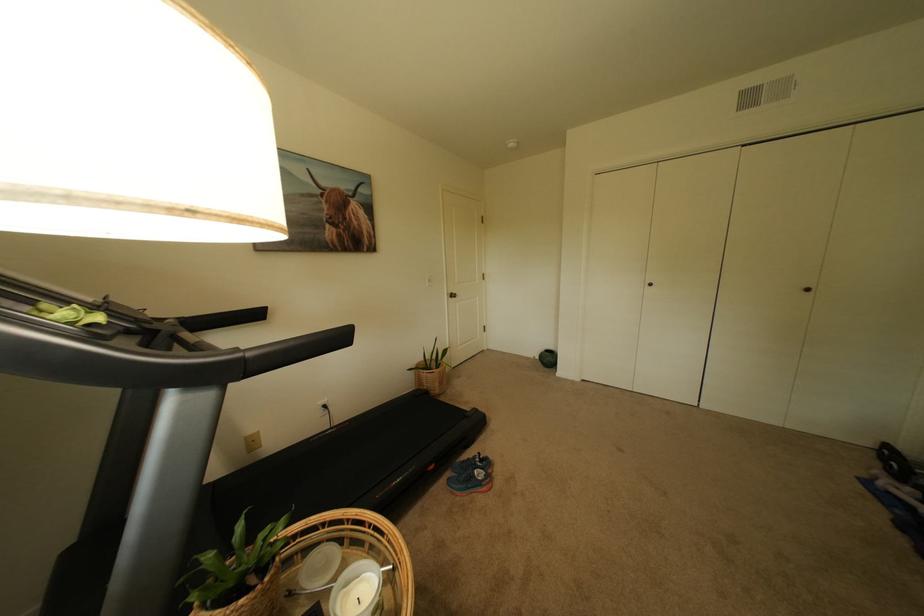
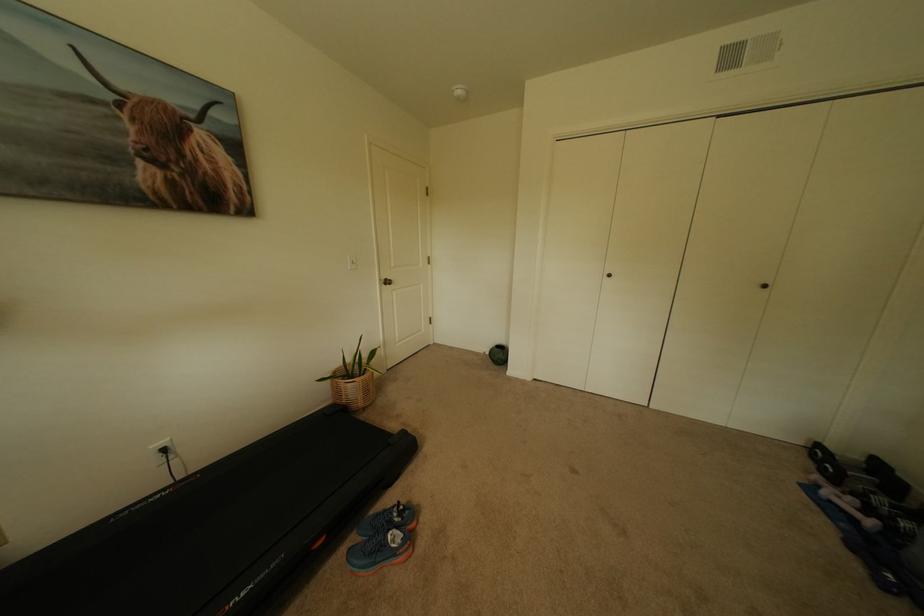
Locate, in the second image, the point that corresponds to the point at 488,463 in the first image.

(407, 517)